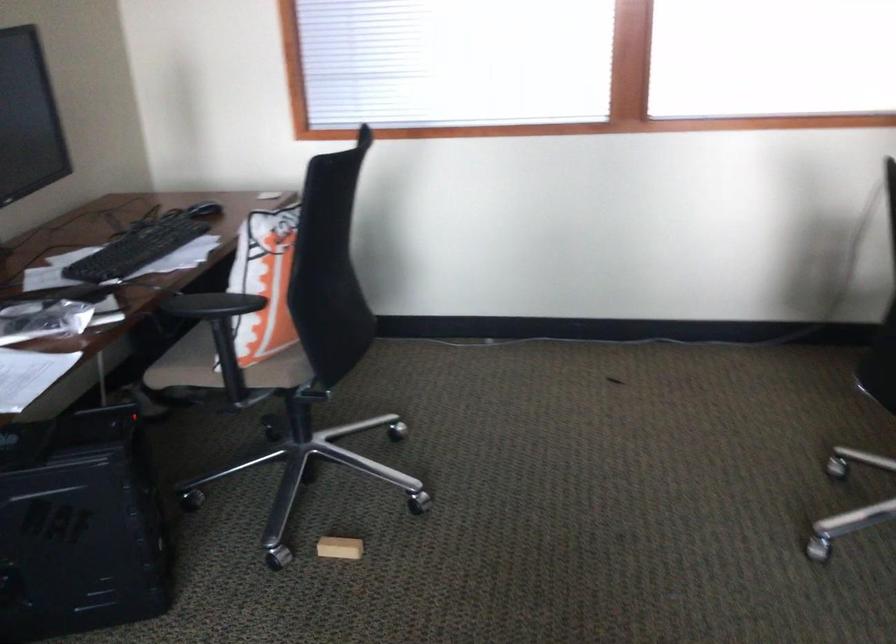
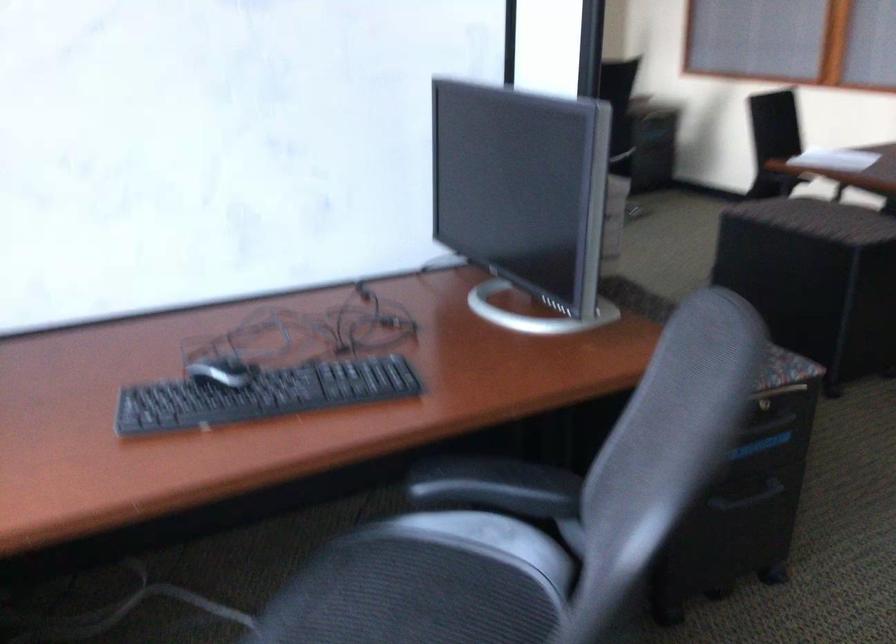
Question: I am providing you with two images of the same scene from different viewpoints. Please identify which objects are invisible in image2.

Choices:
 (A) black chair armrest
 (B) computer mouse
 (C) yellow sports bag
 (D) cabinet drawer handle

Answer: (A)